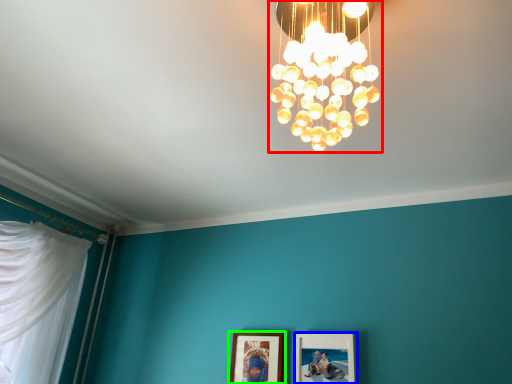
Question: Considering the real-world distances, which object is closest to lamp (highlighted by a red box)? picture frame (highlighted by a blue box) or picture frame (highlighted by a green box).

Choices:
 (A) picture frame
 (B) picture frame

Answer: (A)